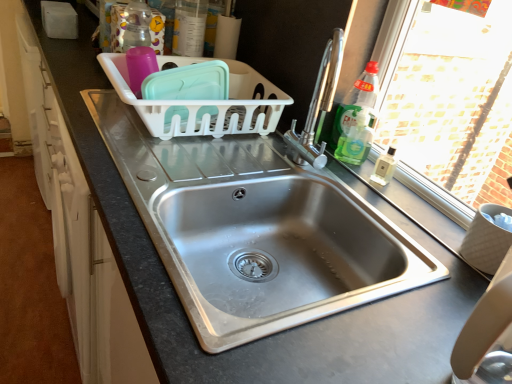
Question: Should I look upward or downward to see stainless steel sink at center, the first sink in the bottom-to-top sequence?

Choices:
 (A) up
 (B) down

Answer: (B)

Question: From a real-world perspective, is white plastic basket at center on top of green glass bottle at upper right, which ranks as the 2th bottle in bottom-to-top order?

Choices:
 (A) yes
 (B) no

Answer: (B)

Question: Is white plastic basket at center looking in the opposite direction of green glass bottle at upper right, the 2th bottle when ordered from left to right?

Choices:
 (A) no
 (B) yes

Answer: (A)

Question: Is white plastic basket at center touching green glass bottle at upper right, marked as the second bottle in a top-to-bottom arrangement?

Choices:
 (A) yes
 (B) no

Answer: (B)

Question: Is white plastic basket at center shorter than green glass bottle at upper right, which ranks as the 2th bottle in bottom-to-top order?

Choices:
 (A) yes
 (B) no

Answer: (A)

Question: Considering the relative positions of white plastic basket at center and green glass bottle at upper right, which ranks as the 2th bottle in bottom-to-top order, in the image provided, is white plastic basket at center behind green glass bottle at upper right, which ranks as the 2th bottle in bottom-to-top order,?

Choices:
 (A) yes
 (B) no

Answer: (B)

Question: Considering the relative sizes of white plastic basket at center and green glass bottle at upper right, which ranks as the 2th bottle in bottom-to-top order, in the image provided, is white plastic basket at center bigger than green glass bottle at upper right, which ranks as the 2th bottle in bottom-to-top order,?

Choices:
 (A) yes
 (B) no

Answer: (A)

Question: Is the position of green glass bottle at upper right, the 2th bottle when ordered from left to right, more distant than that of stainless steel sink at center, the second sink in the top-to-bottom sequence?

Choices:
 (A) yes
 (B) no

Answer: (A)

Question: From the image's perspective, is green glass bottle at upper right, marked as the second bottle in a top-to-bottom arrangement, on stainless steel sink at center, the second sink in the top-to-bottom sequence?

Choices:
 (A) yes
 (B) no

Answer: (A)

Question: Is green glass bottle at upper right, the 2th bottle when ordered from left to right, positioned in front of stainless steel sink at center, the second sink in the top-to-bottom sequence?

Choices:
 (A) no
 (B) yes

Answer: (A)

Question: Is green glass bottle at upper right, which ranks as the 2th bottle in bottom-to-top order, touching stainless steel sink at center, the second sink in the top-to-bottom sequence?

Choices:
 (A) yes
 (B) no

Answer: (B)

Question: From a real-world perspective, is green glass bottle at upper right, the 2th bottle when ordered from left to right, on top of stainless steel sink at center, the first sink in the bottom-to-top sequence?

Choices:
 (A) no
 (B) yes

Answer: (B)

Question: Considering the relative sizes of green glass bottle at upper right, which ranks as the 2th bottle in bottom-to-top order, and stainless steel sink at center, the first sink in the bottom-to-top sequence, in the image provided, is green glass bottle at upper right, which ranks as the 2th bottle in bottom-to-top order, bigger than stainless steel sink at center, the first sink in the bottom-to-top sequence,?

Choices:
 (A) no
 (B) yes

Answer: (A)

Question: Does stainless steel sink at center, the first sink in the bottom-to-top sequence, have a greater height compared to translucent plastic container at upper center, arranged as the third bottle when viewed from the right?

Choices:
 (A) yes
 (B) no

Answer: (A)